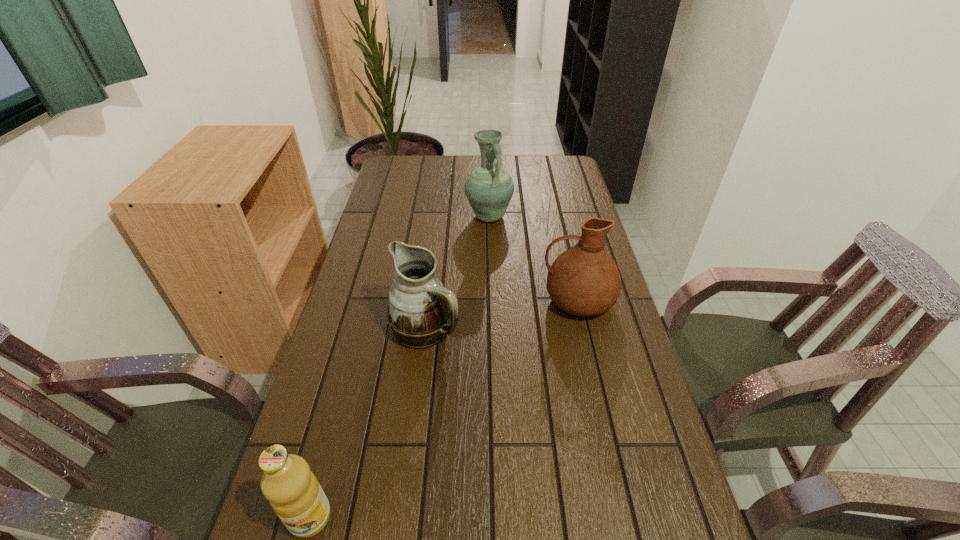
In order to click on the farthest object in this screenshot , I will do `click(489, 188)`.

This screenshot has width=960, height=540. I want to click on the rightmost object, so click(584, 280).

This screenshot has height=540, width=960. What are the coordinates of `free location located on the handle side of the farthest pitcher` in the screenshot? It's located at (x=490, y=239).

The height and width of the screenshot is (540, 960). Find the location of `vacant region located on the side of the rightmost object with the handle`. vacant region located on the side of the rightmost object with the handle is located at coordinates (485, 300).

Image resolution: width=960 pixels, height=540 pixels. Identify the location of blank area located 0.150m on the side of the rightmost object with the handle. pos(488,300).

The height and width of the screenshot is (540, 960). Find the location of `vacant area situated 0.160m on the side of the rightmost object with the handle`. vacant area situated 0.160m on the side of the rightmost object with the handle is located at coordinates (485, 300).

Locate an element on the screen. The image size is (960, 540). object situated at the left edge is located at coordinates (419, 309).

Find the location of a particular element. object at the right edge is located at coordinates (584, 280).

Find the location of a particular element. This screenshot has height=540, width=960. free space at the far edge of the desktop is located at coordinates (458, 170).

This screenshot has height=540, width=960. In the image, there is a desktop. In order to click on free space at the left edge in this screenshot , I will do `click(364, 364)`.